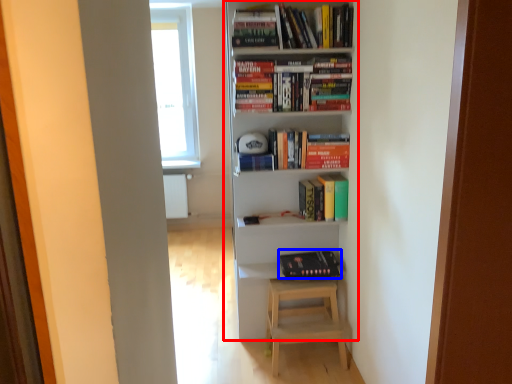
Question: Which object is further to the camera taking this photo, bookcase (highlighted by a red box) or book (highlighted by a blue box)?

Choices:
 (A) bookcase
 (B) book

Answer: (B)